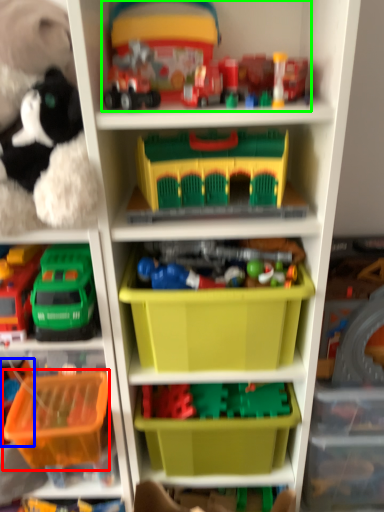
Question: Which is nearer to the storage box (highlighted by a red box)? toy (highlighted by a blue box) or toy (highlighted by a green box).

Choices:
 (A) toy
 (B) toy

Answer: (A)